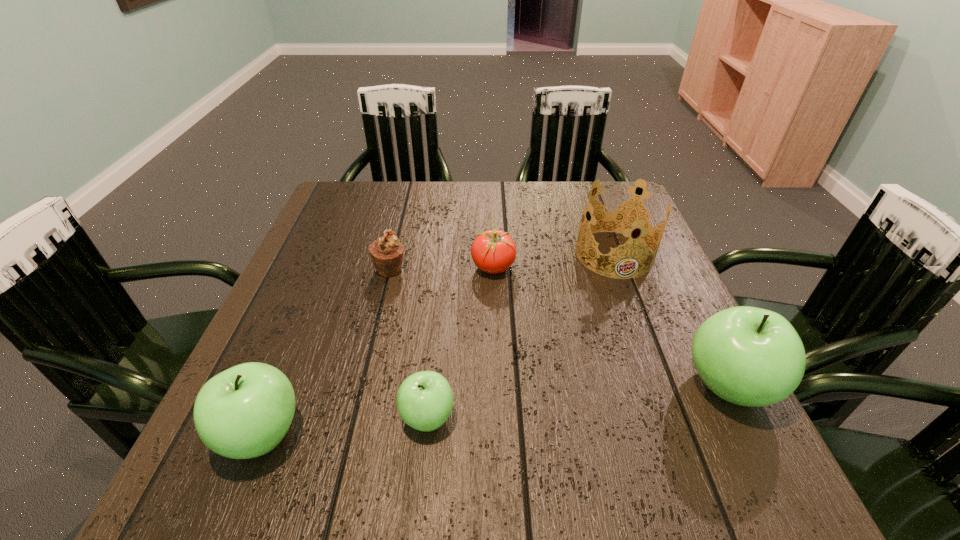
Locate an element on the screen. free space located on the left of the rightmost apple is located at coordinates (551, 386).

Find the location of a particular element. The image size is (960, 540). free space located 0.400m on the left of the crown is located at coordinates 416,254.

What are the coordinates of `vacant space located on the front of the fifth object from right to left` in the screenshot? It's located at [x=381, y=305].

This screenshot has width=960, height=540. Identify the location of vacant space situated on the back of the third object from right to left. (492, 241).

At what (x,y) coordinates should I click in order to perform the action: click on object that is at the left edge. Please return your answer as a coordinate pair (x, y). Looking at the image, I should click on (244, 412).

Locate an element on the screen. The width and height of the screenshot is (960, 540). apple at the right edge is located at coordinates (749, 356).

The height and width of the screenshot is (540, 960). In order to click on crown that is positioned at the right edge in this screenshot , I will do `click(623, 218)`.

Find the location of `object located at the near left corner`. object located at the near left corner is located at coordinates (244, 412).

You are a GUI agent. You are given a task and a screenshot of the screen. Output one action in this format:
    pyautogui.click(x=<x>, y=<y>)
    Task: Click on the object that is at the near right corner
    Image resolution: width=960 pixels, height=540 pixels.
    Given the screenshot: What is the action you would take?
    pyautogui.click(x=749, y=356)

You are a GUI agent. You are given a task and a screenshot of the screen. Output one action in this format:
    pyautogui.click(x=<x>, y=<y>)
    Task: Click on the free space at the far edge of the desktop
    This screenshot has height=540, width=960.
    Given the screenshot: What is the action you would take?
    (469, 194)